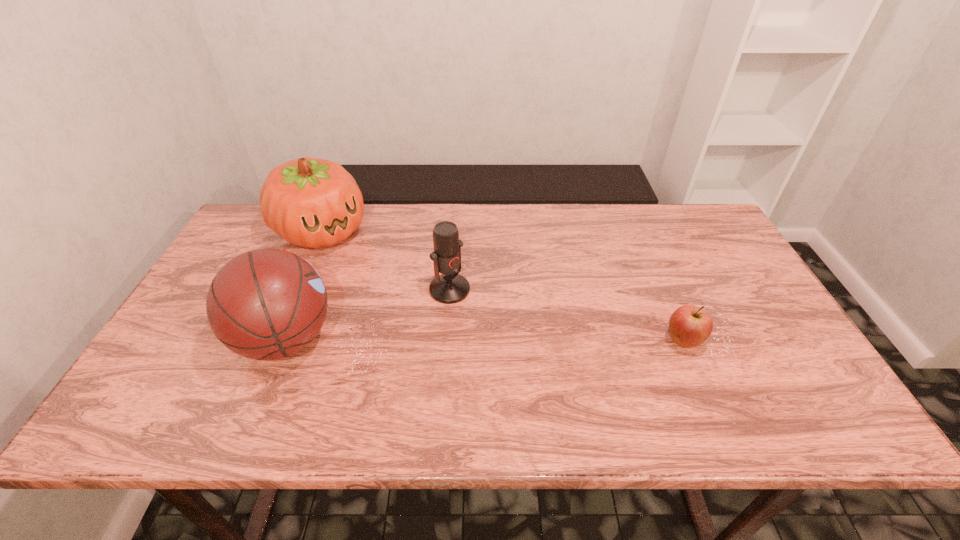
Locate an element on the screen. Image resolution: width=960 pixels, height=540 pixels. basketball is located at coordinates (266, 304).

Where is `apple`? The image size is (960, 540). apple is located at coordinates click(x=690, y=326).

You are a GUI agent. You are given a task and a screenshot of the screen. Output one action in this format:
    pyautogui.click(x=<x>, y=<y>)
    Task: Click on the shortest object
    The width and height of the screenshot is (960, 540).
    Given the screenshot: What is the action you would take?
    pyautogui.click(x=690, y=326)

At what (x,y) coordinates should I click in order to perform the action: click on the farthest object. Please return your answer as a coordinate pair (x, y). The width and height of the screenshot is (960, 540). Looking at the image, I should click on (310, 202).

Where is `the second object from right to left`? This screenshot has height=540, width=960. the second object from right to left is located at coordinates (448, 288).

Identify the location of microphone. The height and width of the screenshot is (540, 960). (448, 288).

At what (x,y) coordinates should I click in order to perform the action: click on vacant space located on the back of the basketball. Please return your answer as a coordinate pair (x, y). Looking at the image, I should click on (330, 230).

This screenshot has width=960, height=540. Identify the location of free space located on the left of the rightmost object. (623, 341).

This screenshot has height=540, width=960. Identify the location of vacant region located 0.200m on the side of the farthest object with the cute face. (382, 289).

The image size is (960, 540). In order to click on vacant space located on the side of the farthest object with the cute face in this screenshot , I will do `click(396, 302)`.